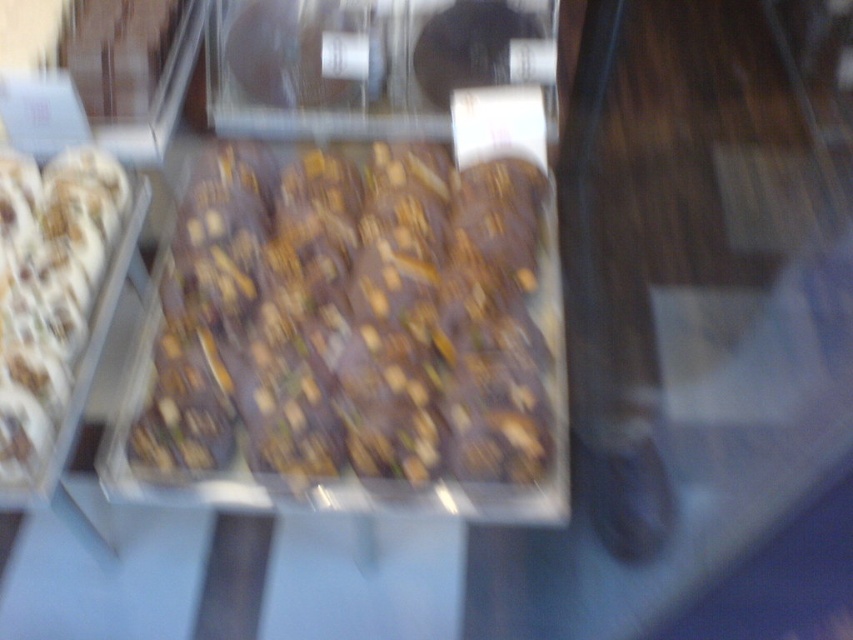
Question: Among these objects, which one is farthest from the camera?

Choices:
 (A) white frosted donut at left
 (B) dark chocolate bar at center

Answer: (B)

Question: Which of the following is the closest to the observer?

Choices:
 (A) (1, 160)
 (B) (393, 330)

Answer: (B)

Question: Can you confirm if dark chocolate bar at center is positioned to the left of white frosted donut at left?

Choices:
 (A) yes
 (B) no

Answer: (B)

Question: Is dark chocolate bar at center further to camera compared to white frosted donut at left?

Choices:
 (A) yes
 (B) no

Answer: (A)

Question: Can you confirm if dark chocolate bar at center is thinner than white frosted donut at left?

Choices:
 (A) yes
 (B) no

Answer: (B)

Question: Among these points, which one is farthest from the camera?

Choices:
 (A) (152, 362)
 (B) (25, 205)

Answer: (B)